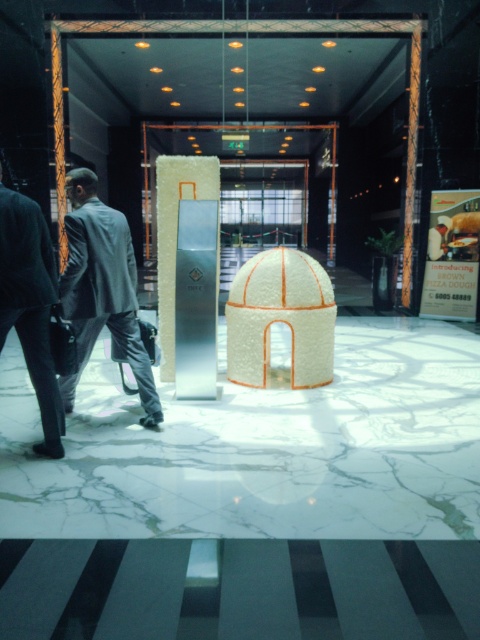
You are standing in the lobby and want to move from the point closer to you to the point further away. Which path should you take? The points are point (168, 164) and point (6, 296).

The point (168, 164) is closer to you, so you should move towards the point (6, 296), which is further away.